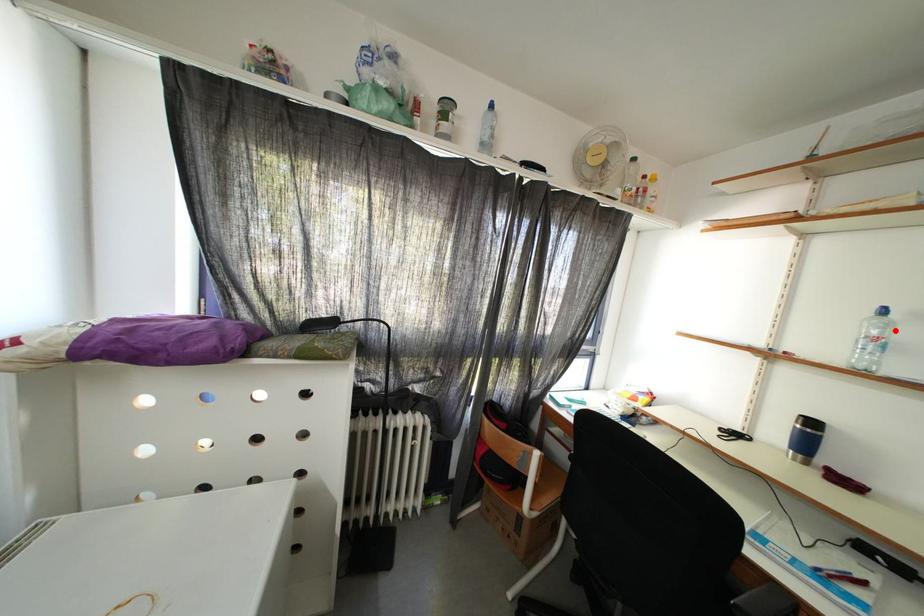
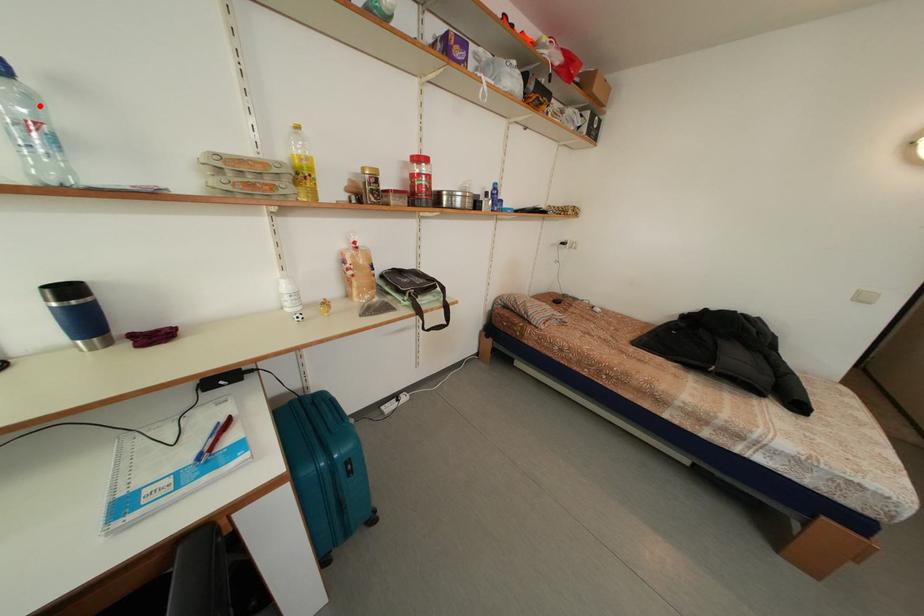
I am providing you with two images of the same scene from different viewpoints. A red point is marked on the first image and another point is marked on the second image. Do the highlighted points in image1 and image2 indicate the same real-world spot?

Yes